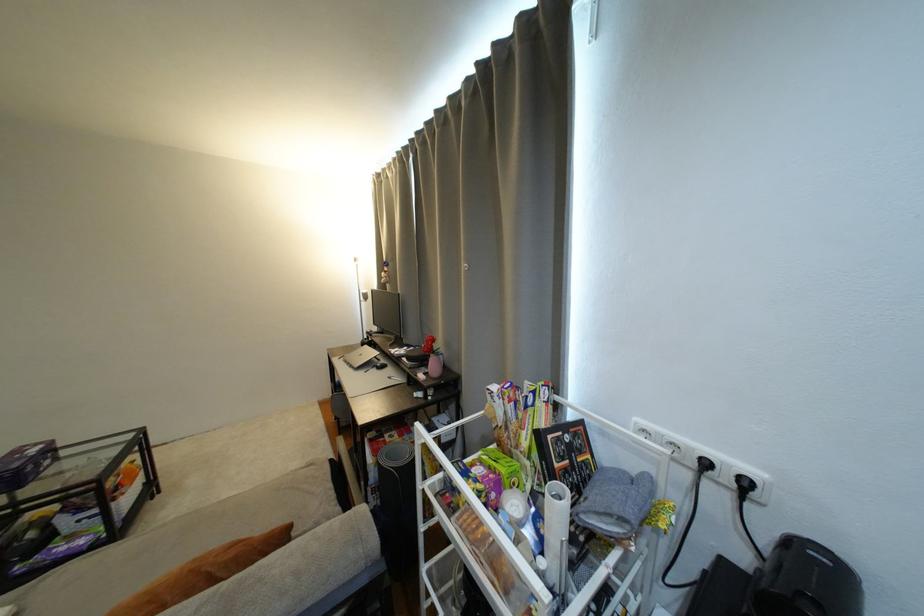
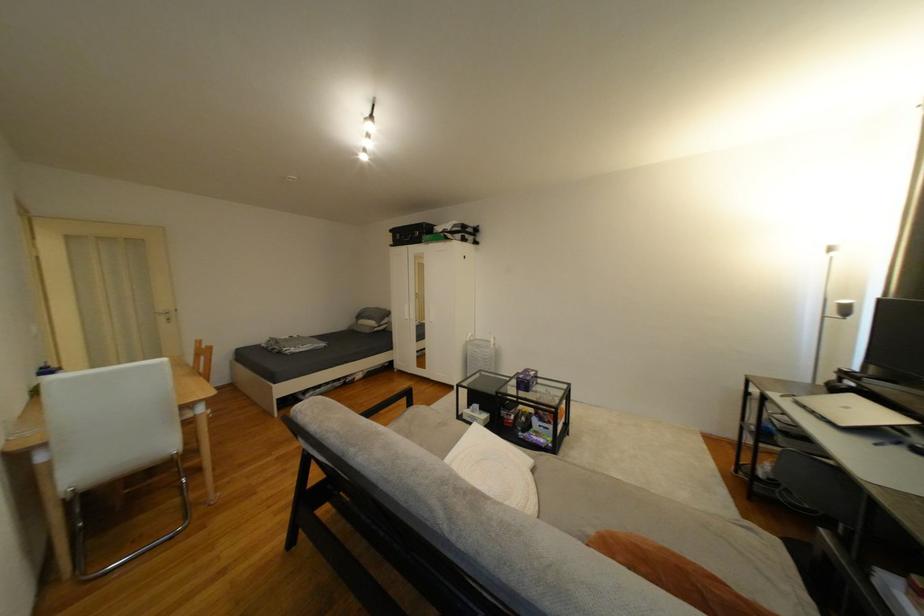
Question: The camera is either moving clockwise (left) or counter-clockwise (right) around the object. The first image is from the beginning of the video and the second image is from the end. Is the camera moving left or right when shooting the video?

Choices:
 (A) Left
 (B) Right

Answer: (B)